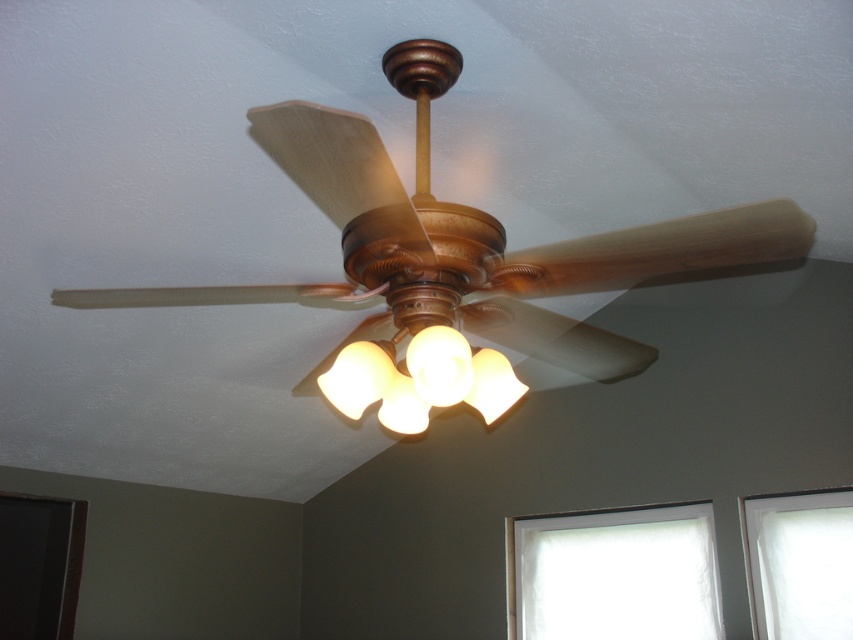
Question: Is wooden ceiling fan at center behind translucent frosted glass light fixture at center?

Choices:
 (A) yes
 (B) no

Answer: (B)

Question: Which point is closer to the camera taking this photo?

Choices:
 (A) [x=306, y=145]
 (B) [x=431, y=348]

Answer: (A)

Question: Is wooden ceiling fan at center bigger than translucent frosted glass light fixture at center?

Choices:
 (A) no
 (B) yes

Answer: (B)

Question: Does wooden ceiling fan at center have a smaller size compared to translucent frosted glass light fixture at center?

Choices:
 (A) yes
 (B) no

Answer: (B)